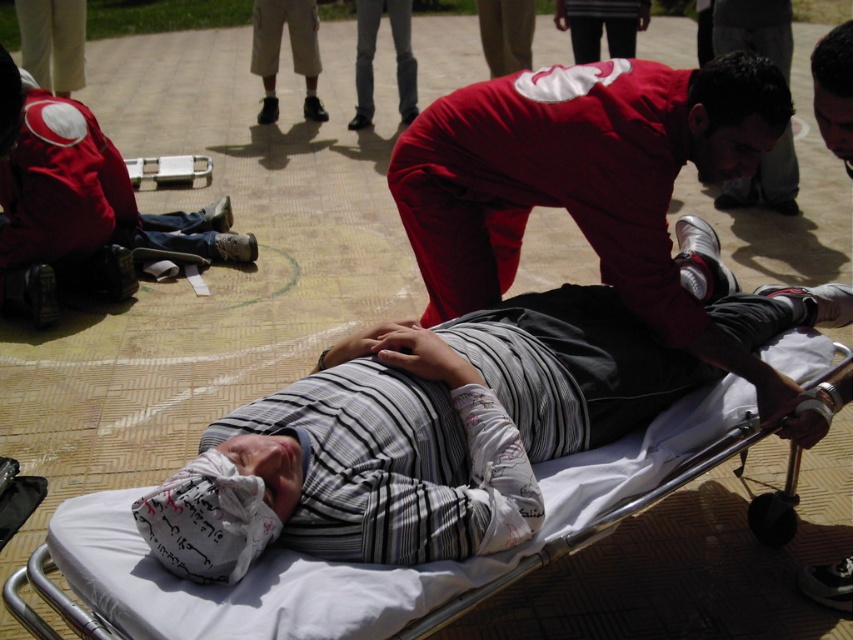
Is matte red uniform at center taller than white fabric stretcher at center?

Indeed, matte red uniform at center has a greater height compared to white fabric stretcher at center.

Is matte red uniform at center to the right of white fabric stretcher at center from the viewer's perspective?

Yes, matte red uniform at center is to the right of white fabric stretcher at center.

Is point (474, 141) farther from camera compared to point (239, 609)?

Yes, it is behind point (239, 609).

What are the coordinates of `matte red uniform at center` in the screenshot? It's located at pos(577,172).

Can you confirm if matte red uniform at center is positioned below matte red backpack at upper left?

Yes.

Is matte red uniform at center taller than matte red backpack at upper left?

No, matte red uniform at center is not taller than matte red backpack at upper left.

Describe the element at coordinates (577, 172) in the screenshot. I see `matte red uniform at center` at that location.

Where is `matte red uniform at center`? The image size is (853, 640). matte red uniform at center is located at coordinates (577, 172).

Does white fabric stretcher at center come in front of striped fabric shirt at center?

Yes, it is.

Can you confirm if white fabric stretcher at center is smaller than striped fabric shirt at center?

Incorrect, white fabric stretcher at center is not smaller in size than striped fabric shirt at center.

Does point (111, 522) come farther from viewer compared to point (811, 428)?

No, (111, 522) is in front of (811, 428).

The height and width of the screenshot is (640, 853). Find the location of `white fabric stretcher at center`. white fabric stretcher at center is located at coordinates (360, 566).